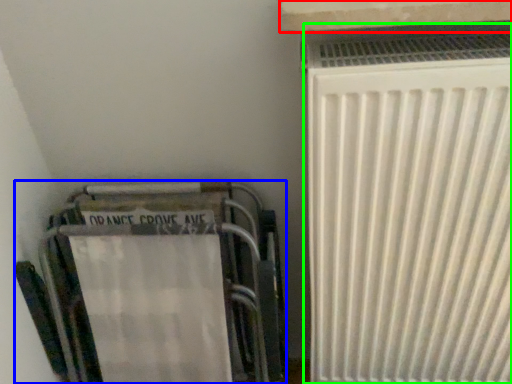
Question: Which object is the closest to the window sill (highlighted by a red box)? Choose among these: furniture (highlighted by a blue box) or radiator (highlighted by a green box).

Choices:
 (A) furniture
 (B) radiator

Answer: (B)